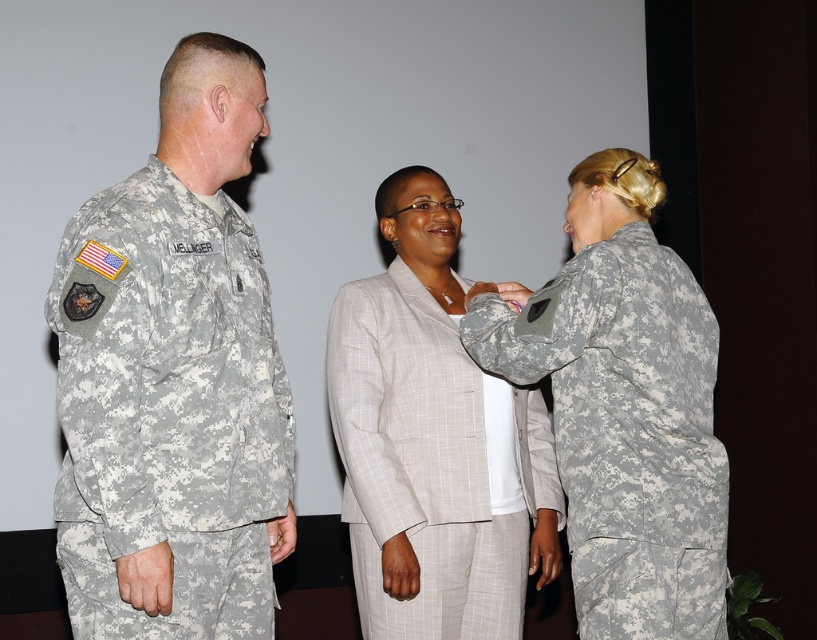
Between camouflage uniform at right and light beige fabric suit at center, which one is positioned lower?

light beige fabric suit at center is lower down.

Describe the element at coordinates (623, 406) in the screenshot. This screenshot has width=817, height=640. I see `camouflage uniform at right` at that location.

Find the location of a particular element. camouflage uniform at right is located at coordinates (623, 406).

Based on the photo, can you confirm if camouflage uniform at left is shorter than light beige fabric suit at center?

No, camouflage uniform at left is not shorter than light beige fabric suit at center.

Between camouflage uniform at left and light beige fabric suit at center, which one has less height?

With less height is light beige fabric suit at center.

Does point (69, 310) come behind point (362, 417)?

No, it is not.

The width and height of the screenshot is (817, 640). Identify the location of camouflage uniform at left. (173, 378).

Is camouflage uniform at left shorter than camouflage uniform at right?

No, camouflage uniform at left is not shorter than camouflage uniform at right.

Can you confirm if camouflage uniform at left is positioned to the right of camouflage uniform at right?

Incorrect, camouflage uniform at left is not on the right side of camouflage uniform at right.

Does point (181, 369) come in front of point (498, 364)?

Yes, it is.

The image size is (817, 640). What are the coordinates of `camouflage uniform at left` in the screenshot? It's located at (173, 378).